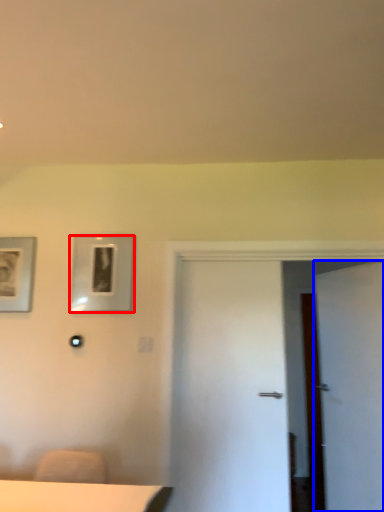
Question: Which of the following is the farthest to the observer, picture frame (highlighted by a red box) or door (highlighted by a blue box)?

Choices:
 (A) picture frame
 (B) door

Answer: (A)